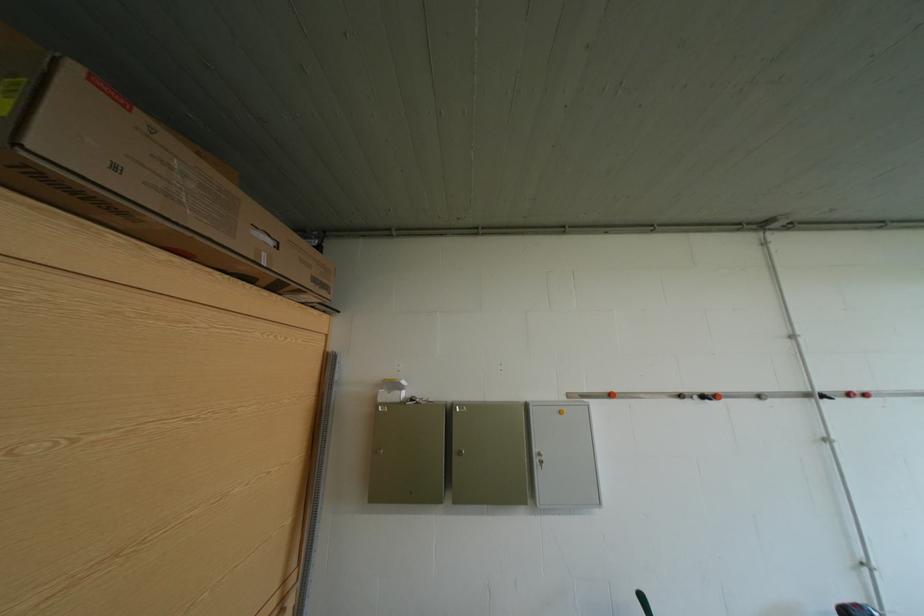
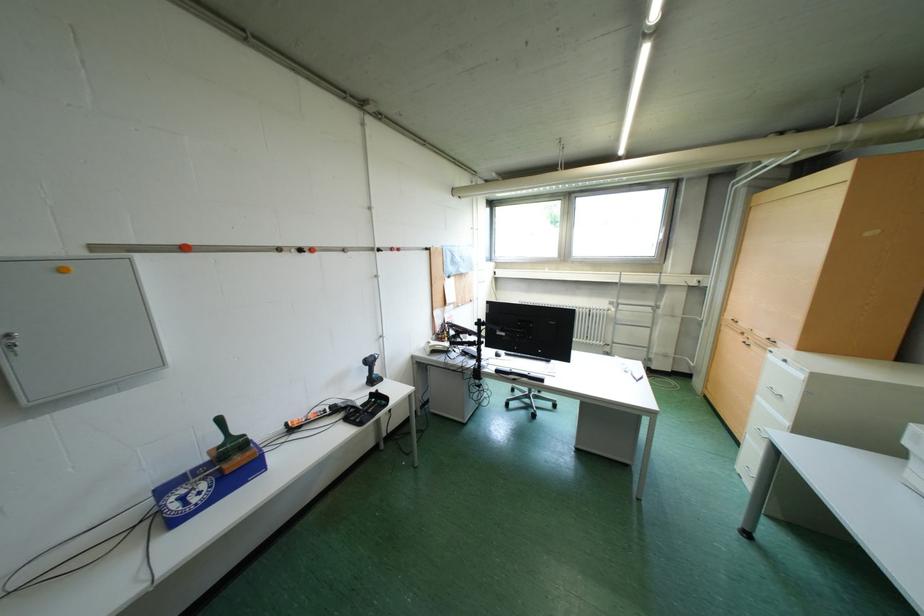
The first image is from the beginning of the video and the second image is from the end. How did the camera likely rotate when shooting the video?

The camera rotated toward right-down.